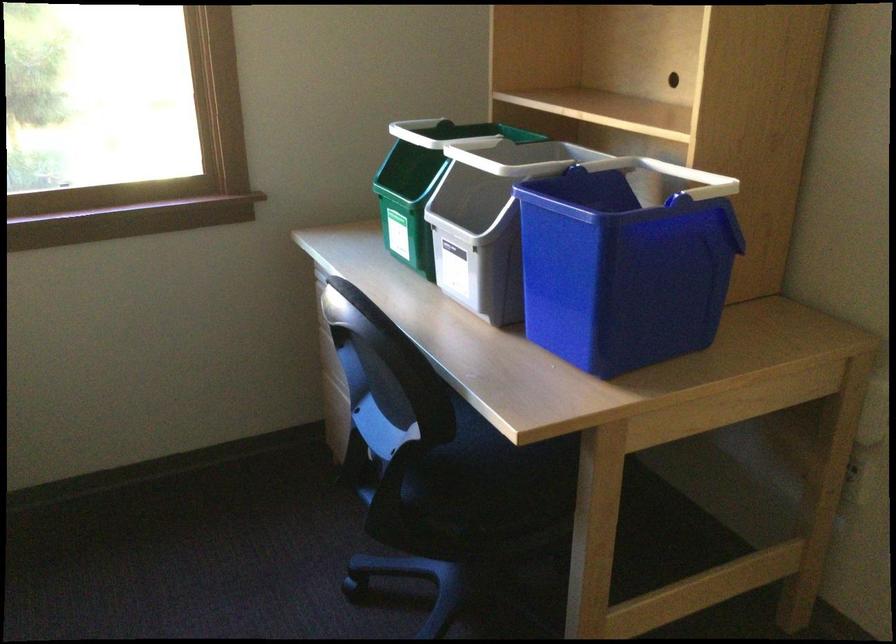
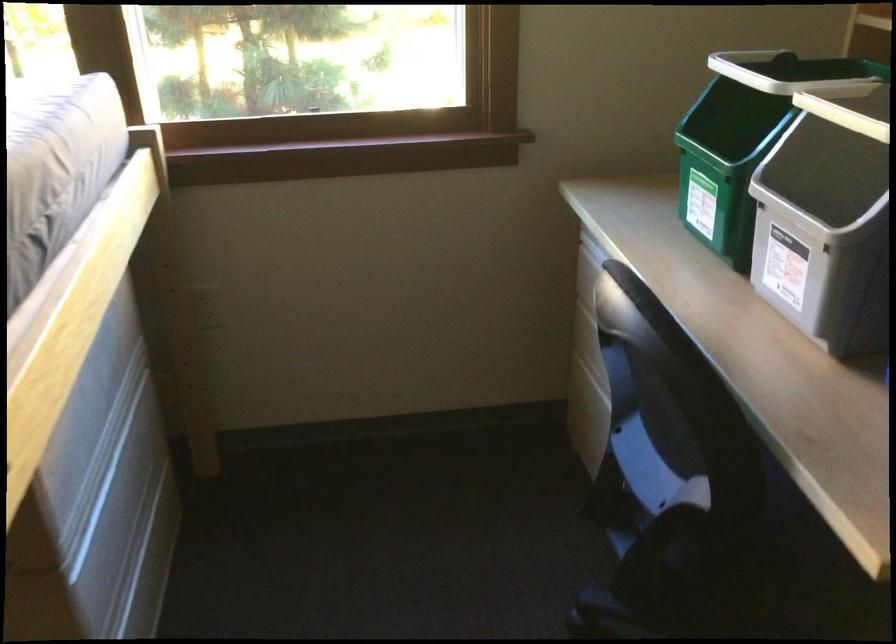
Question: Based on the continuous images, in which direction is the camera rotating? Reply with the corresponding letter.

Choices:
 (A) Left
 (B) Right
 (C) Up
 (D) Down

Answer: (A)